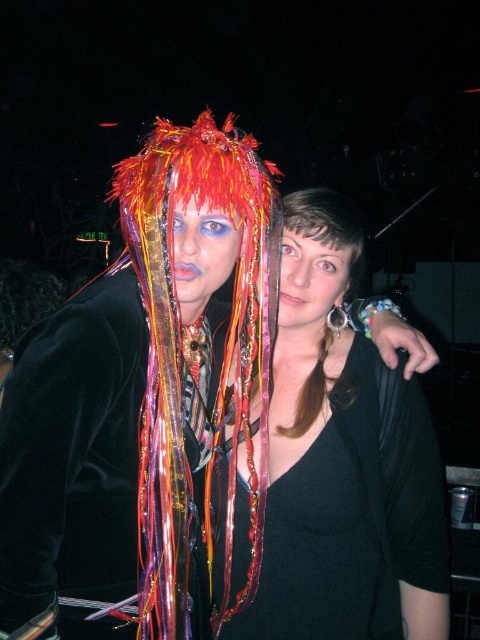
Question: Can you confirm if matte black dress at center is wider than matte black face at center?

Choices:
 (A) no
 (B) yes

Answer: (B)

Question: Among these points, which one is nearest to the camera?

Choices:
 (A) (204, 273)
 (B) (156, 232)
 (C) (391, 376)
 (D) (312, 275)

Answer: (B)

Question: Where is matte black dress at center located in relation to matte black face at center in the image?

Choices:
 (A) below
 (B) above

Answer: (A)

Question: Estimate the real-world distances between objects in this image. Which object is farther from the shiny multicolored ribbons at center?

Choices:
 (A) matte black face at center
 (B) matte black dress at center

Answer: (A)

Question: Does matte black dress at center have a larger size compared to shiny multicolored ribbons at center?

Choices:
 (A) yes
 (B) no

Answer: (B)

Question: Which object appears farthest from the camera in this image?

Choices:
 (A) matte black face at center
 (B) shiny multicolored ribbons at center
 (C) matte black dress at center
 (D) shiny metallic face at center

Answer: (A)